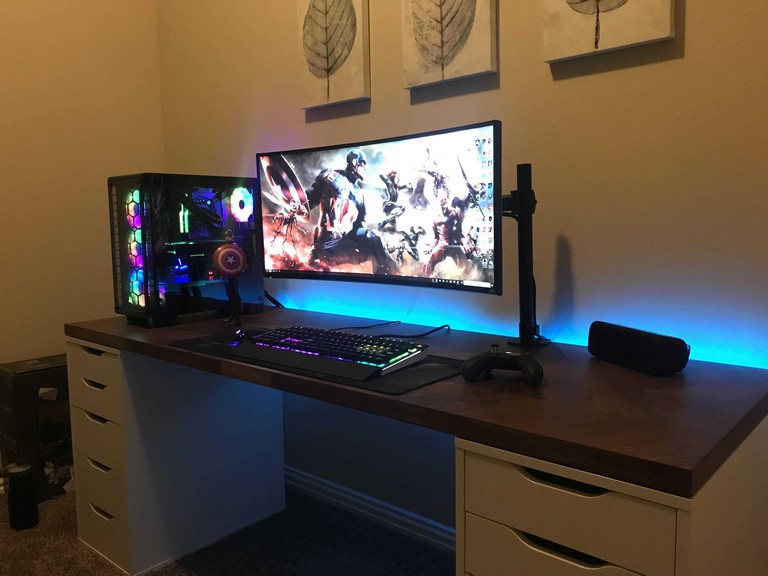
Locate an element on the screen. The image size is (768, 576). the top left hand drawer is located at coordinates (104, 362).